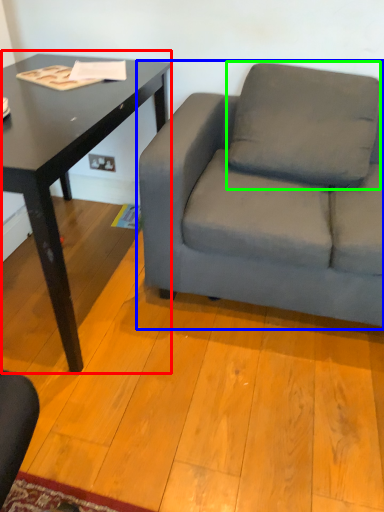
Question: Based on their relative distances, which object is farther from table (highlighted by a red box)? Choose from studio couch (highlighted by a blue box) and pillow (highlighted by a green box).

Choices:
 (A) studio couch
 (B) pillow

Answer: (B)